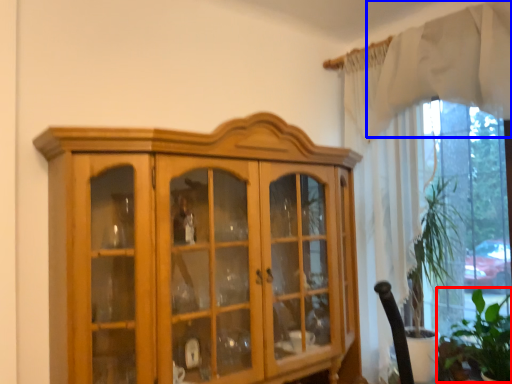
Question: Which of the following is the farthest to the observer, plant (highlighted by a red box) or curtain (highlighted by a blue box)?

Choices:
 (A) plant
 (B) curtain

Answer: (A)